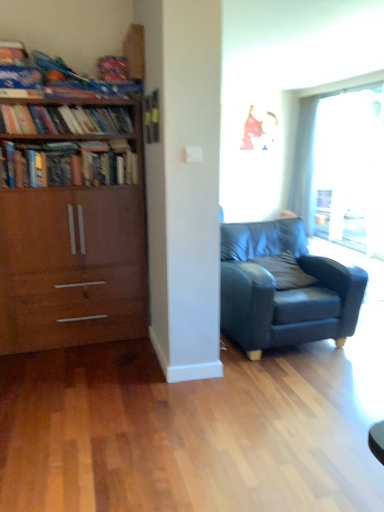
Question: From a real-world perspective, is white sheer curtain at upper right positioned above or below transparent glass window at upper right?

Choices:
 (A) above
 (B) below

Answer: (A)

Question: Based on their sizes in the image, would you say white sheer curtain at upper right is bigger or smaller than transparent glass window at upper right?

Choices:
 (A) big
 (B) small

Answer: (A)

Question: Based on their relative distances, which object is nearer to the wooden bookshelf at left, the second book from the bottom?

Choices:
 (A) gray fabric pillow at center
 (B) transparent glass window at upper right
 (C) hardcover books at left, which appears as the second book when viewed from the top
 (D) matte black armchair at center
 (E) wooden bookcase at left

Answer: (C)

Question: Estimate the real-world distances between objects in this image. Which object is farther from the wooden bookcase at left?

Choices:
 (A) hardcover books at left, the first book when ordered from bottom to top
 (B) gray fabric pillow at center
 (C) matte black armchair at center
 (D) transparent glass window at upper right
 (E) white sheer curtain at upper right

Answer: (E)